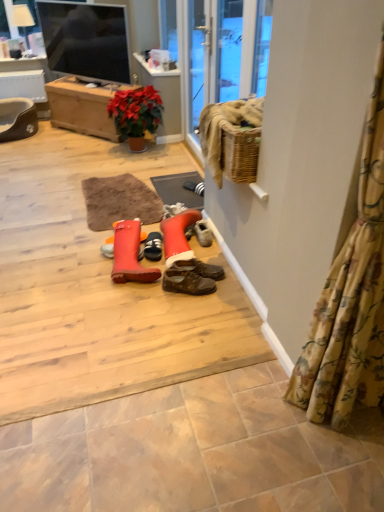
The image size is (384, 512). I want to click on free space in front of rubberized orange boot at center, which ranks as the third footwear in right-to-left order, so click(x=127, y=301).